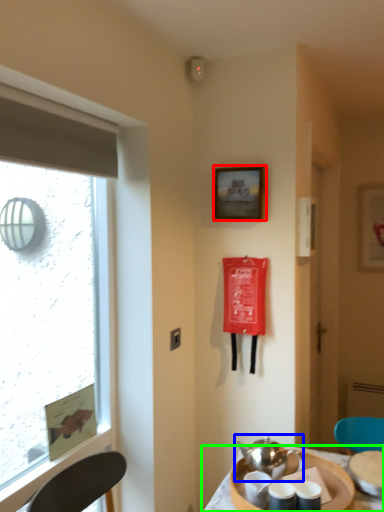
Question: Based on their relative distances, which object is farther from picture frame (highlighted by a red box)? Choose from tea set (highlighted by a blue box) and table (highlighted by a green box).

Choices:
 (A) tea set
 (B) table

Answer: (B)